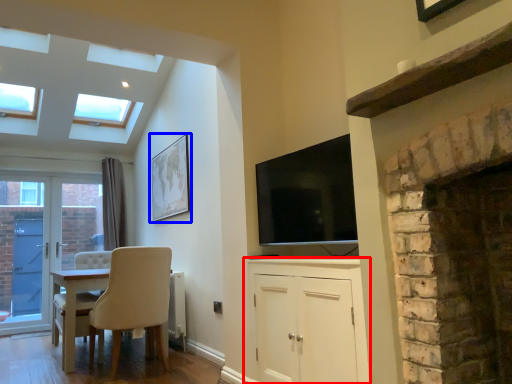
Question: Among these objects, which one is farthest to the camera, cabinetry (highlighted by a red box) or picture frame (highlighted by a blue box)?

Choices:
 (A) cabinetry
 (B) picture frame

Answer: (B)